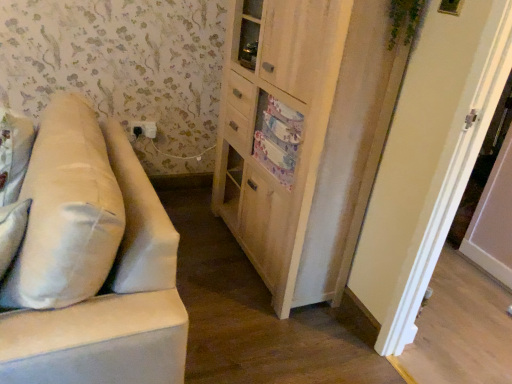
Find the location of `beige fabric couch at left`. beige fabric couch at left is located at coordinates (87, 260).

Image resolution: width=512 pixels, height=384 pixels. I want to click on white painted wood door at right, so click(429, 160).

Between beige fabric couch at left and white fabric pillow at left, which one has smaller width?

white fabric pillow at left.

From the image's perspective, which one is positioned higher, beige fabric couch at left or white fabric pillow at left?

beige fabric couch at left.

Which object is positioned more to the right, beige fabric couch at left or white fabric pillow at left?

beige fabric couch at left is more to the right.

Can you see beige fabric couch at left touching black plastic outlet at upper left?

They are not placed beside each other.

Considering the relative sizes of beige fabric couch at left and black plastic outlet at upper left in the image provided, is beige fabric couch at left wider than black plastic outlet at upper left?

Yes.

In the scene shown: Is beige fabric couch at left to the right of black plastic outlet at upper left from the viewer's perspective?

Yes.

How different are the orientations of beige fabric couch at left and black plastic outlet at upper left in degrees?

The angle between the facing direction of beige fabric couch at left and the facing direction of black plastic outlet at upper left is 87.6 degrees.

Is wooden cabinet at center surrounded by black plastic outlet at upper left?

No, wooden cabinet at center is not surrounded by black plastic outlet at upper left.

From the image's perspective, is black plastic outlet at upper left positioned above or below wooden cabinet at center?

Based on their image positions, black plastic outlet at upper left is located above wooden cabinet at center.

Is black plastic outlet at upper left in front of or behind wooden cabinet at center in the image?

black plastic outlet at upper left is behind wooden cabinet at center.

Does point (154, 133) lie behind point (229, 129)?

Yes, point (154, 133) is farther from viewer.

Does white fabric pillow at left appear on the left side of black plastic outlet at upper left?

In fact, white fabric pillow at left is to the right of black plastic outlet at upper left.

From a real-world perspective, who is located higher, white fabric pillow at left or black plastic outlet at upper left?

In real-world perspective, white fabric pillow at left is above.

Would you say black plastic outlet at upper left is part of white fabric pillow at left's contents?

No, white fabric pillow at left does not contain black plastic outlet at upper left.

Considering the sizes of white fabric pillow at left and white painted wood door at right in the image, is white fabric pillow at left bigger or smaller than white painted wood door at right?

In the image, white fabric pillow at left appears to be smaller than white painted wood door at right.

From the picture: Is white fabric pillow at left located outside white painted wood door at right?

white fabric pillow at left lies outside white painted wood door at right's area.

Is white fabric pillow at left behind white painted wood door at right?

That is False.

Is point (24, 272) closer to viewer compared to point (420, 272)?

Yes, point (24, 272) is closer to viewer.

Based on the photo, how distant is white fabric pillow at left from wooden cabinet at center?

33.95 inches.

Based on the photo, is white fabric pillow at left taller than wooden cabinet at center?

No, white fabric pillow at left is not taller than wooden cabinet at center.

Consider the image. Which point is more forward, (115, 234) or (273, 12)?

Point (115, 234)

In the image, is white fabric pillow at left positioned in front of or behind wooden cabinet at center?

Clearly, white fabric pillow at left is in front of wooden cabinet at center.

From a real-world perspective, is white painted wood door at right physically located above or below beige fabric couch at left?

white painted wood door at right is above beige fabric couch at left.

How much distance is there between white painted wood door at right and beige fabric couch at left?

A distance of 1.08 meters exists between white painted wood door at right and beige fabric couch at left.

Who is taller, white painted wood door at right or beige fabric couch at left?

Standing taller between the two is white painted wood door at right.

Does white painted wood door at right turn towards beige fabric couch at left?

No.

The image size is (512, 384). In order to click on studio couch on the right of white fabric pillow at left in this screenshot , I will do `click(87, 260)`.

I want to click on electric outlet located on the left of beige fabric couch at left, so click(x=144, y=129).

From the image, which object appears to be nearer to white painted wood door at right, wooden cabinet at center or white fabric pillow at left?

wooden cabinet at center lies closer to white painted wood door at right than the other object.

Considering their positions, is wooden cabinet at center positioned closer to beige fabric couch at left than white fabric pillow at left?

Among the two, white fabric pillow at left is located nearer to beige fabric couch at left.

Considering their positions, is black plastic outlet at upper left positioned further to beige fabric couch at left than white painted wood door at right?

black plastic outlet at upper left.

From the image, which object appears to be nearer to black plastic outlet at upper left, wooden cabinet at center or white fabric pillow at left?

wooden cabinet at center lies closer to black plastic outlet at upper left than the other object.

When comparing their distances from wooden cabinet at center, does beige fabric couch at left or black plastic outlet at upper left seem closer?

Based on the image, beige fabric couch at left appears to be nearer to wooden cabinet at center.

Estimate the real-world distances between objects in this image. Which object is closer to beige fabric couch at left, white fabric pillow at left or white painted wood door at right?

white fabric pillow at left.

From the image, which object appears to be farther from wooden cabinet at center, black plastic outlet at upper left or white fabric pillow at left?

Among the two, black plastic outlet at upper left is located further to wooden cabinet at center.

Looking at the image, which one is located further to white fabric pillow at left, white painted wood door at right or black plastic outlet at upper left?

Based on the image, black plastic outlet at upper left appears to be further to white fabric pillow at left.

Where is `cabinetry located between white fabric pillow at left and white painted wood door at right in the left-right direction`? Image resolution: width=512 pixels, height=384 pixels. cabinetry located between white fabric pillow at left and white painted wood door at right in the left-right direction is located at coordinates (276, 128).

Where is `door between white fabric pillow at left and black plastic outlet at upper left from front to back`? The width and height of the screenshot is (512, 384). door between white fabric pillow at left and black plastic outlet at upper left from front to back is located at coordinates (429, 160).

Where is `cabinetry located between beige fabric couch at left and black plastic outlet at upper left in the depth direction`? cabinetry located between beige fabric couch at left and black plastic outlet at upper left in the depth direction is located at coordinates (276, 128).

The width and height of the screenshot is (512, 384). Find the location of `door between beige fabric couch at left and black plastic outlet at upper left from front to back`. door between beige fabric couch at left and black plastic outlet at upper left from front to back is located at coordinates (429, 160).